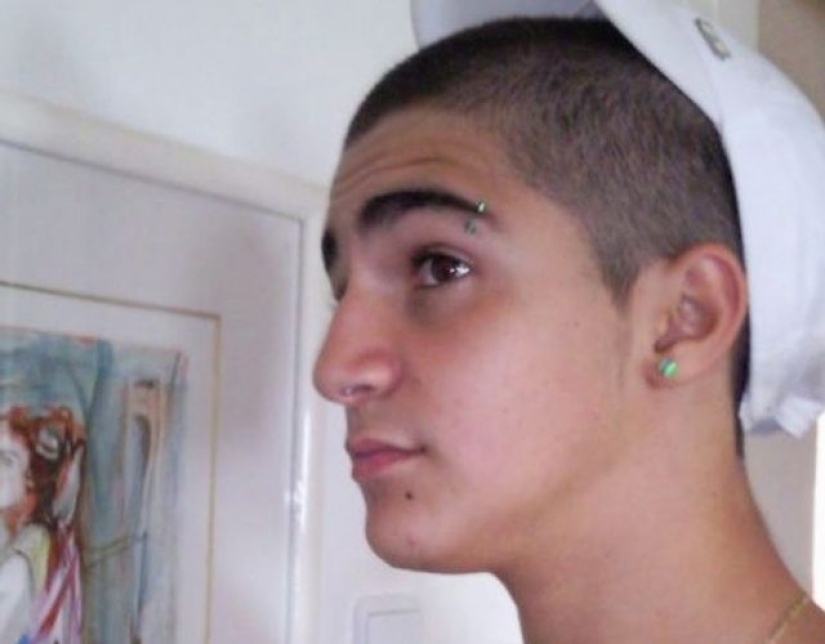
Locate an element on the screen. The height and width of the screenshot is (644, 825). white frame is located at coordinates (178, 169).